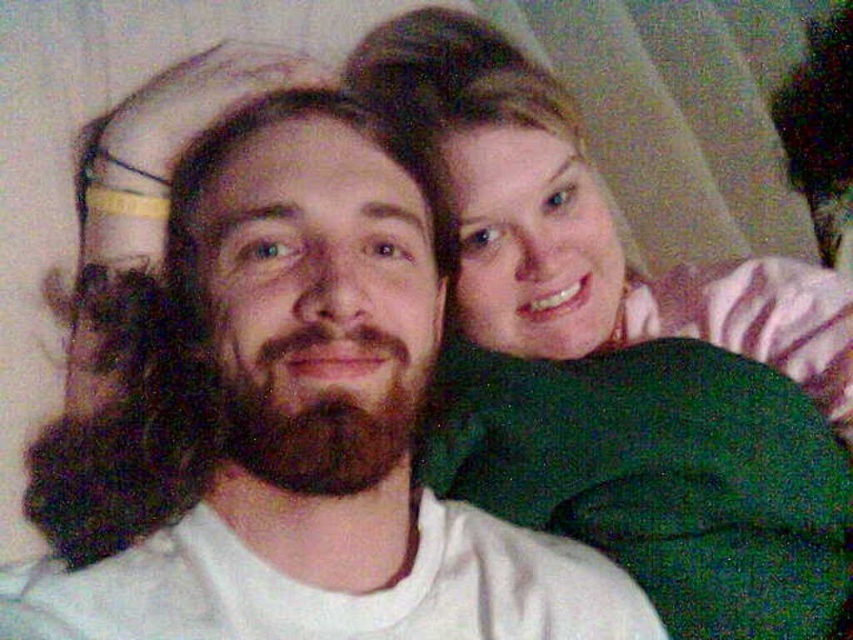
Question: From the image, what is the correct spatial relationship of matte green sweater at upper right in relation to dark brown thick beard at center?

Choices:
 (A) right
 (B) left

Answer: (A)

Question: Among these objects, which one is nearest to the camera?

Choices:
 (A) matte green sweater at upper right
 (B) dark brown thick beard at center

Answer: (B)

Question: Which point is closer to the camera taking this photo?

Choices:
 (A) (225, 420)
 (B) (410, 49)

Answer: (A)

Question: Is matte green sweater at upper right below dark brown thick beard at center?

Choices:
 (A) yes
 (B) no

Answer: (B)

Question: From the image, what is the correct spatial relationship of matte green sweater at upper right in relation to dark brown thick beard at center?

Choices:
 (A) left
 (B) right

Answer: (B)